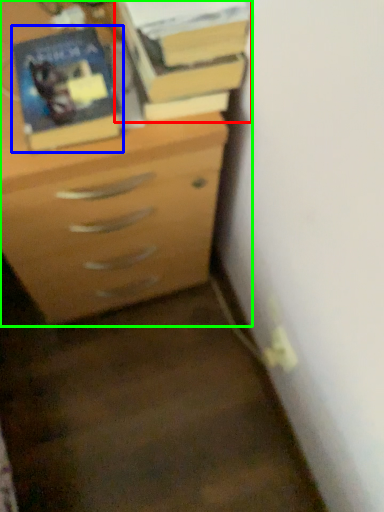
Question: Considering the real-world distances, which object is farthest from book (highlighted by a red box)? paperback book (highlighted by a blue box) or chest of drawers (highlighted by a green box)?

Choices:
 (A) paperback book
 (B) chest of drawers

Answer: (B)